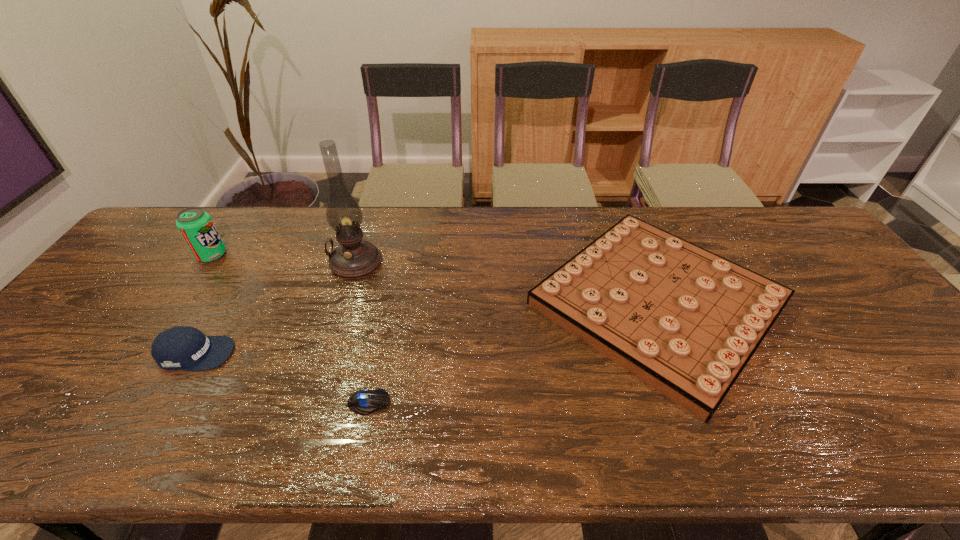
Locate an element on the screen. unoccupied area between the oil lamp and the baseball cap is located at coordinates (276, 308).

The image size is (960, 540). I want to click on vacant space that's between the tallest object and the baseball cap, so click(276, 308).

Image resolution: width=960 pixels, height=540 pixels. I want to click on unoccupied area between the second object from right to left and the pop soda, so (x=290, y=329).

Image resolution: width=960 pixels, height=540 pixels. I want to click on object that is the fourth nearest to the computer mouse, so (x=195, y=225).

Select which object appears as the closest to the oil lamp. Please provide its 2D coordinates. Your answer should be formatted as a tuple, i.e. [(x, y)], where the tuple contains the x and y coordinates of a point satisfying the conditions above.

[(186, 348)]

Image resolution: width=960 pixels, height=540 pixels. I want to click on vacant space that satisfies the following two spatial constraints: 1. on the front-facing side of the pop soda; 2. on the back side of the oil lamp, so click(x=206, y=262).

The image size is (960, 540). Find the location of `blank area in the image that satisfies the following two spatial constraints: 1. on the back side of the third object from right to left; 2. on the front-facing side of the second tallest object`. blank area in the image that satisfies the following two spatial constraints: 1. on the back side of the third object from right to left; 2. on the front-facing side of the second tallest object is located at coordinates [x=357, y=255].

In order to click on free space that satisfies the following two spatial constraints: 1. on the front side of the third object from left to right; 2. on the front-facing side of the baseball cap in this screenshot , I will do `click(326, 353)`.

You are a GUI agent. You are given a task and a screenshot of the screen. Output one action in this format:
    pyautogui.click(x=<x>, y=<y>)
    Task: Click on the free space that satisfies the following two spatial constraints: 1. on the front-facing side of the fourth shortest object; 2. on the back side of the gameboard
    This screenshot has width=960, height=540.
    Given the screenshot: What is the action you would take?
    pyautogui.click(x=179, y=303)